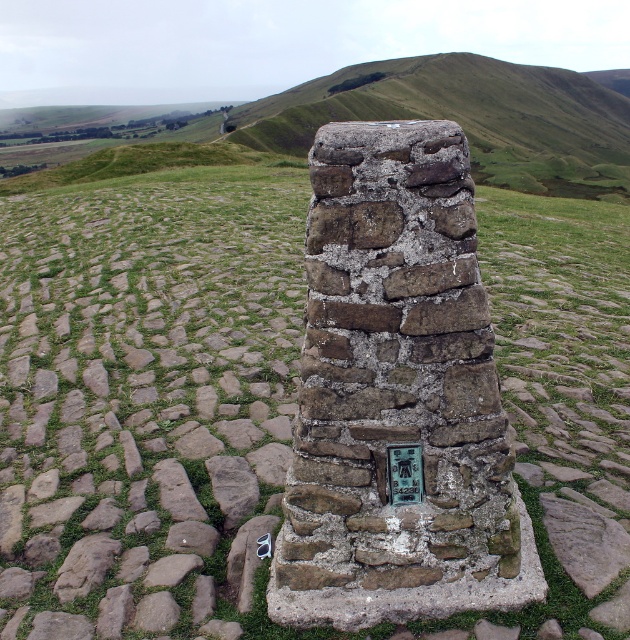
Question: Which object is farther from the camera taking this photo?

Choices:
 (A) metallic gray sunglasses at center
 (B) green metallic plaque at center
 (C) rustic stone cairn at center

Answer: (C)

Question: Is weathered stone marker at center above metallic gray sunglasses at center?

Choices:
 (A) no
 (B) yes

Answer: (B)

Question: Can you confirm if weathered stone marker at center is wider than rustic stone cairn at center?

Choices:
 (A) no
 (B) yes

Answer: (A)

Question: Which of the following is the farthest from the observer?

Choices:
 (A) rustic stone cairn at center
 (B) weathered stone marker at center
 (C) green metallic plaque at center

Answer: (A)

Question: Is weathered stone marker at center smaller than green metallic plaque at center?

Choices:
 (A) no
 (B) yes

Answer: (A)

Question: Which object is the farthest from the green metallic plaque at center?

Choices:
 (A) rustic stone cairn at center
 (B) metallic gray sunglasses at center

Answer: (A)